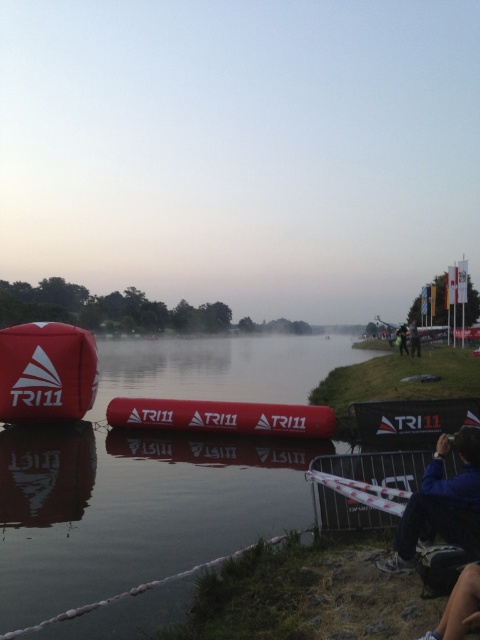
You are a participant in the triathlon looking for the starting line marked by the matte red buoy at center. You see a blue fabric jacket at lower right nearby. Is the jacket closer to the water than the buoy?

The blue fabric jacket at lower right is located above the matte red buoy at center, meaning it is closer to the water than the buoy. Therefore, the jacket is indeed closer to the water than the matte red buoy at center.

You are a photographer trying to capture the TRI11 event. You notice the matte red buoy at left and the blue fabric jacket at lower right. Which object should you focus on if you want to photograph something taller in the scene?

The matte red buoy at left is much taller than the blue fabric jacket at lower right, so you should focus on the matte red buoy at left for a taller subject.

You are a participant in the triathlon and need to swim from your current position near the blue fabric jacket at lower right to the matte red buoy at center. Given that you can swim at a speed of 1.5 meters per second, how many seconds will it take you to reach the buoy?

The distance between the blue fabric jacket at lower right and the matte red buoy at center is 8.25 meters. At a swimming speed of 1.5 meters per second, it will take you approximately 5.5 seconds to reach the buoy.